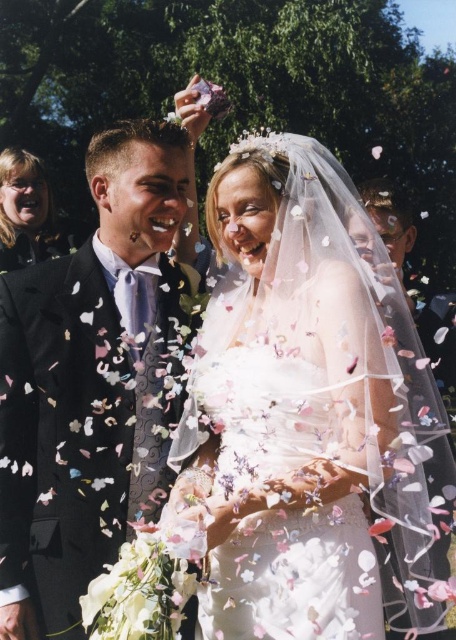
Based on the coordinates provided, where is the black satin suit at left located in the image?

The black satin suit at left is located at the 2D coordinates point (x=88, y=381) in the image.

You are a photographer at the wedding and need to frame the white satin dress at center and the matte black jacket at upper left in your shot. Which object is wider?

The white satin dress at center is wider than the matte black jacket at upper left.